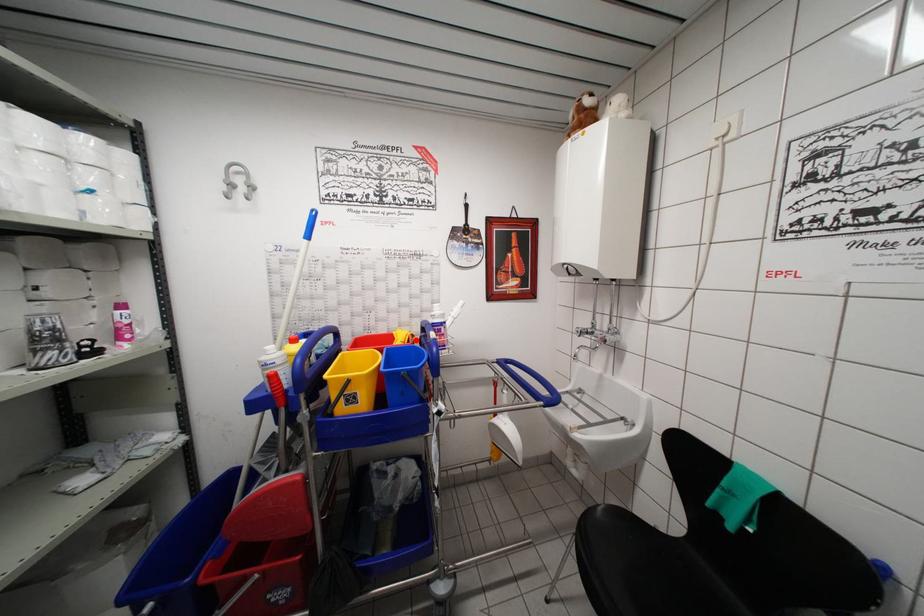
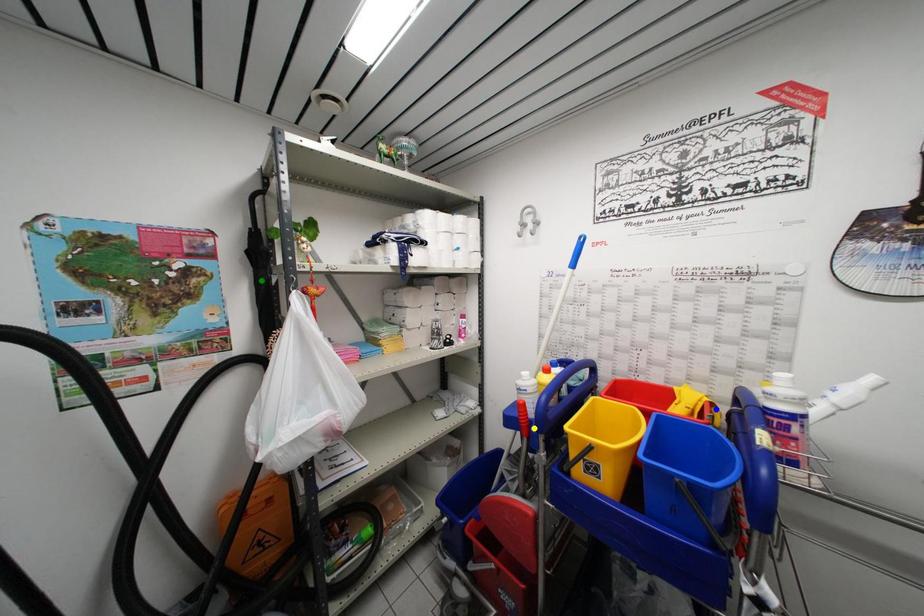
Question: I am providing you with two images of the same scene from different viewpoints. A red point is marked on the first image. You are given multiple points on the second image. In image 2, which mark is for the same physical point as the one in image 1?

Choices:
 (A) yellow point
 (B) green point
 (C) blue point

Answer: (C)